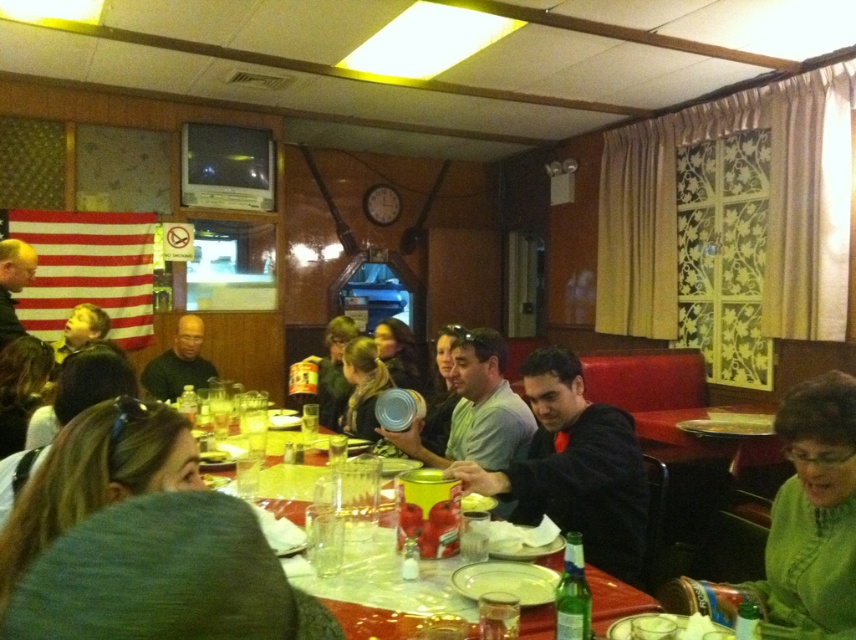
You are a server in this restaurant and need to place a new order of drinks on the table. The drinks are in a tray that can only hold items that are shorter than the smooth leather jacket at upper left. Can you safely place the drinks next to the matte black can at center without exceeding the height limit?

The smooth leather jacket at upper left is taller than the matte black can at center. Since the drinks must be shorter than the jacket, they can be placed next to the matte black can at center as long as their height doesn